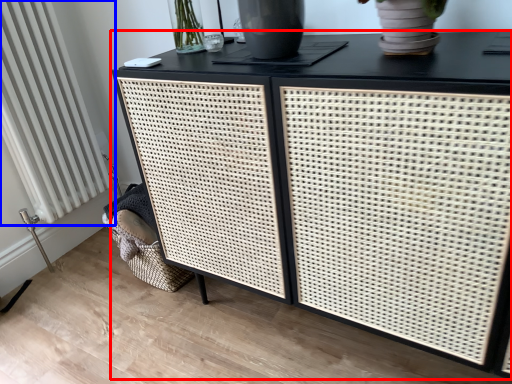
Question: Which of the following is the closest to the observer, table (highlighted by a red box) or radiator (highlighted by a blue box)?

Choices:
 (A) table
 (B) radiator

Answer: (A)